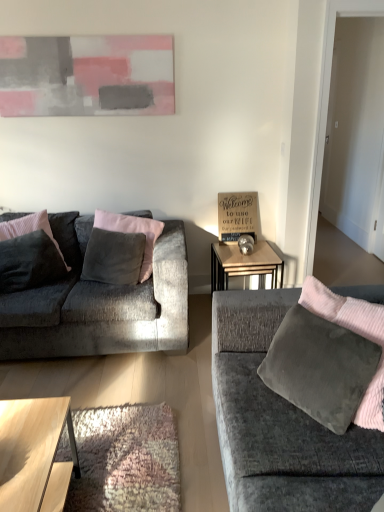
Question: Does velvet gray pillow at center, which is the 2th pillow from left to right, have a lesser height compared to light brown wooden coffee table at lower left?

Choices:
 (A) yes
 (B) no

Answer: (B)

Question: Is light brown wooden coffee table at lower left at the back of velvet gray pillow at center, which is the 2th pillow from left to right?

Choices:
 (A) no
 (B) yes

Answer: (A)

Question: Is velvet gray pillow at center, the first pillow in the right-to-left sequence, located outside light brown wooden coffee table at lower left?

Choices:
 (A) no
 (B) yes

Answer: (B)

Question: Does velvet gray pillow at center, the first pillow in the right-to-left sequence, touch light brown wooden coffee table at lower left?

Choices:
 (A) yes
 (B) no

Answer: (B)

Question: From a real-world perspective, is velvet gray pillow at center, which is the 2th pillow from left to right, located higher than light brown wooden coffee table at lower left?

Choices:
 (A) yes
 (B) no

Answer: (A)

Question: Based on their sizes in the image, would you say light brown wooden coffee table at lower left is bigger or smaller than velvet gray couch at right, marked as the 1th studio couch in a right-to-left arrangement?

Choices:
 (A) small
 (B) big

Answer: (A)

Question: Is point (61, 461) positioned closer to the camera than point (228, 362)?

Choices:
 (A) closer
 (B) farther

Answer: (A)

Question: From the image's perspective, is light brown wooden coffee table at lower left located above or below velvet gray couch at right, marked as the 1th studio couch in a right-to-left arrangement?

Choices:
 (A) below
 (B) above

Answer: (A)

Question: From a real-world perspective, is light brown wooden coffee table at lower left above or below velvet gray couch at right, which ranks as the second studio couch in back-to-front order?

Choices:
 (A) above
 (B) below

Answer: (B)

Question: Is velvet gray pillow at center, the first pillow in the right-to-left sequence, taller or shorter than metallic silver table at center?

Choices:
 (A) tall
 (B) short

Answer: (A)

Question: In terms of size, does velvet gray pillow at center, the first pillow in the right-to-left sequence, appear bigger or smaller than metallic silver table at center?

Choices:
 (A) small
 (B) big

Answer: (A)

Question: From the image's perspective, relative to metallic silver table at center, is velvet gray pillow at center, the first pillow in the right-to-left sequence, above or below?

Choices:
 (A) above
 (B) below

Answer: (A)

Question: Is point (152, 231) positioned closer to the camera than point (256, 246)?

Choices:
 (A) closer
 (B) farther

Answer: (A)

Question: Does point (61, 249) appear closer or farther from the camera than point (139, 279)?

Choices:
 (A) closer
 (B) farther

Answer: (B)

Question: Is velvet dark gray pillow at left, which is counted as the second pillow, starting from the right, bigger or smaller than velvet gray pillow at center, which is the 2th pillow from left to right?

Choices:
 (A) big
 (B) small

Answer: (A)